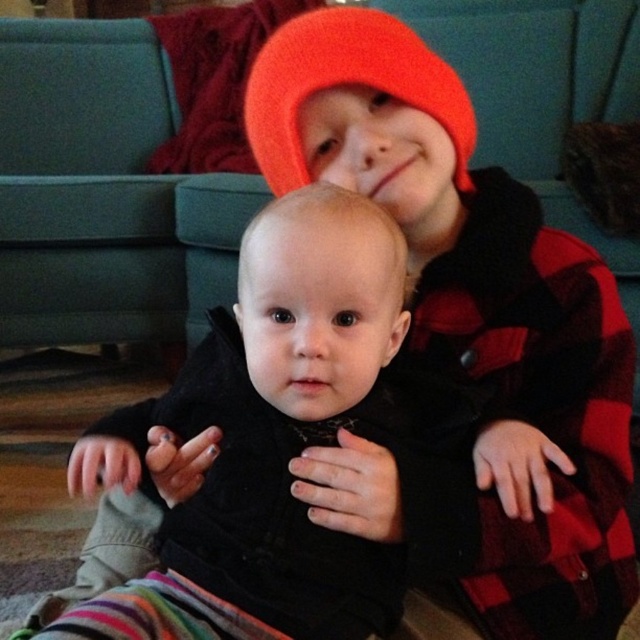
Between black matte baby at center and orange knit beanie at upper center, which one has more height?

black matte baby at center

Is point (241, 365) positioned in front of point (394, 22)?

Yes, it is.

Image resolution: width=640 pixels, height=640 pixels. In order to click on black matte baby at center in this screenshot , I will do `click(292, 449)`.